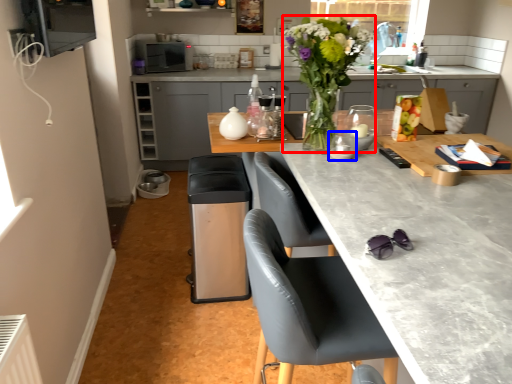
Question: Which object appears farthest to the camera in this image, floral arrangement (highlighted by a red box) or appliance (highlighted by a blue box)?

Choices:
 (A) floral arrangement
 (B) appliance

Answer: (B)